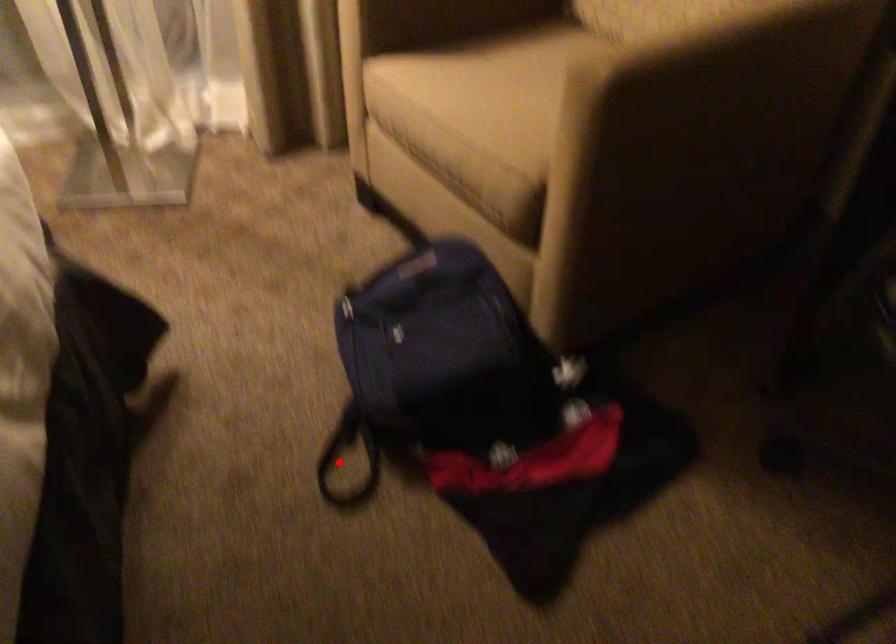
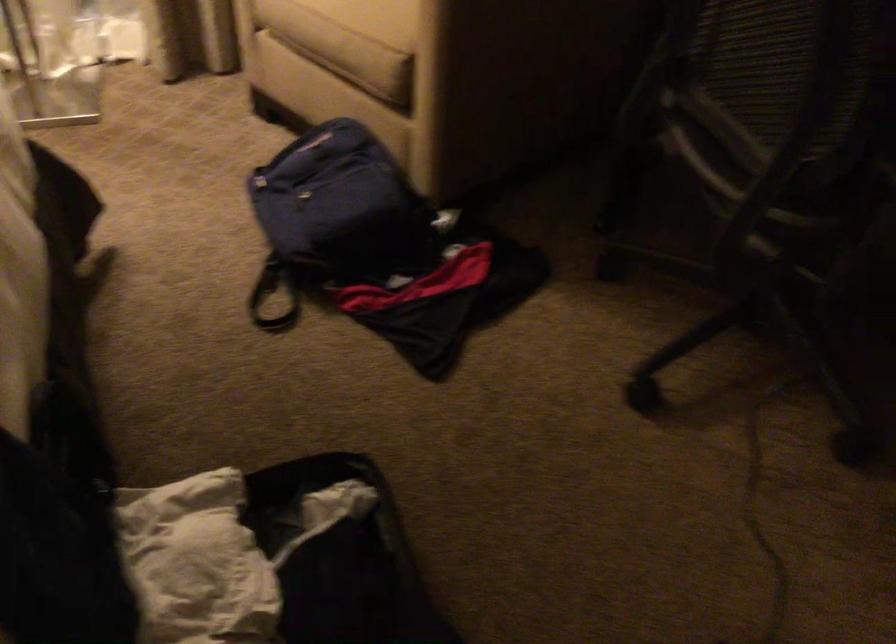
Question: I am providing you with two images of the same scene from different viewpoints. In image1, a red point is highlighted. Considering the same 3D point in image2, which of the following is correct?

Choices:
 (A) It is closer
 (B) It is farther

Answer: (B)